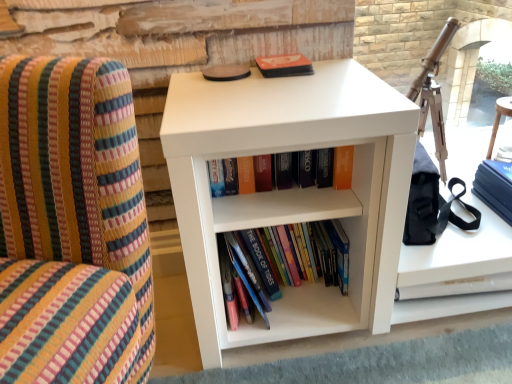
This screenshot has height=384, width=512. I want to click on free location to the right of matte orange paperback book at upper center, marked as the first paperback book in a left-to-right arrangement, so click(x=333, y=67).